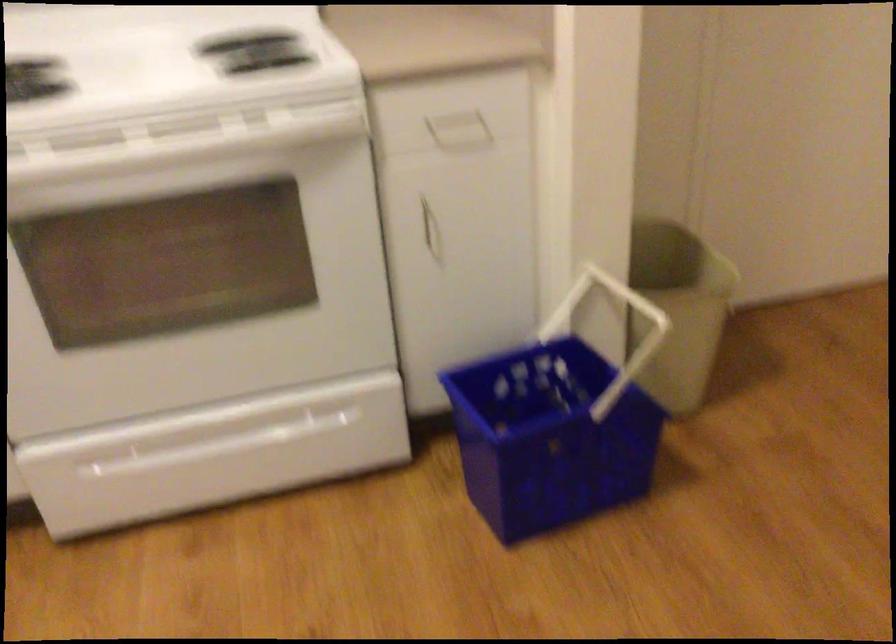
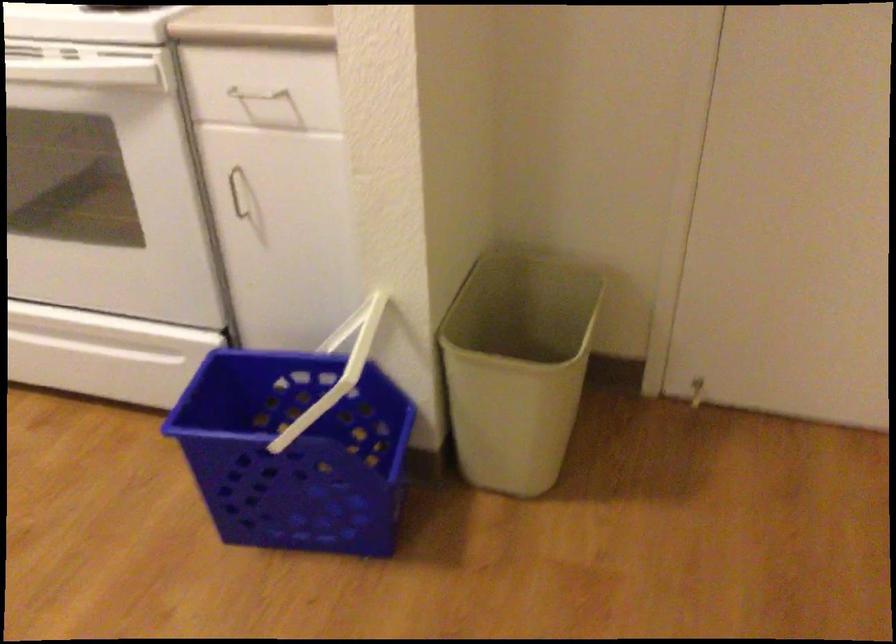
Find the pixel in the second image that matches (709,288) in the first image.

(517, 366)